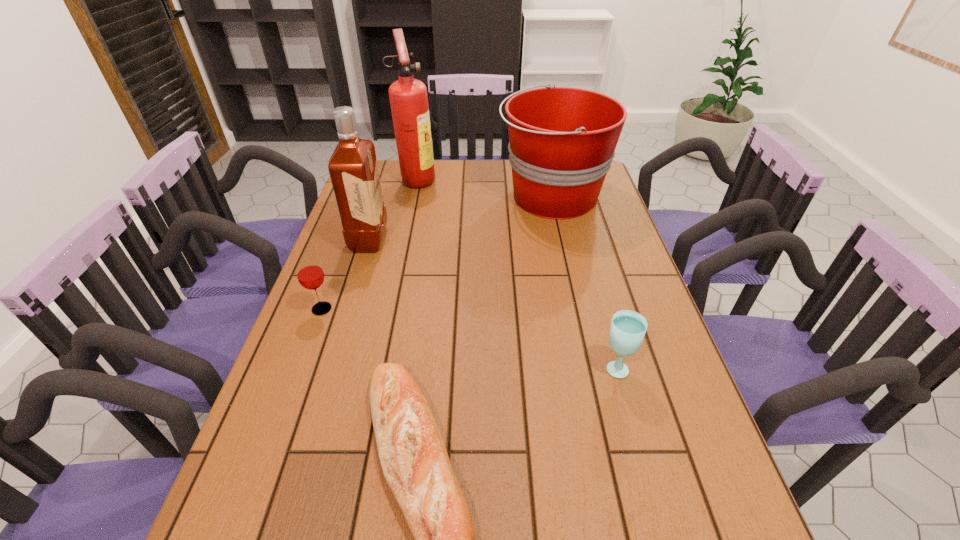
Locate an element on the screen. The height and width of the screenshot is (540, 960). free space at the far edge is located at coordinates (491, 183).

The width and height of the screenshot is (960, 540). In the image, there is a desktop. What are the coordinates of `free space at the left edge` in the screenshot? It's located at (227, 523).

The height and width of the screenshot is (540, 960). In order to click on free spot at the right edge of the desktop in this screenshot , I will do `click(642, 284)`.

The width and height of the screenshot is (960, 540). I want to click on vacant space at the far left corner, so click(396, 160).

You are a GUI agent. You are given a task and a screenshot of the screen. Output one action in this format:
    pyautogui.click(x=<x>, y=<y>)
    Task: Click on the free space between the left glass and the liquor
    The width and height of the screenshot is (960, 540).
    Given the screenshot: What is the action you would take?
    pyautogui.click(x=346, y=274)

This screenshot has width=960, height=540. Find the location of `vacant space that is in between the tallest object and the nearer glass`. vacant space that is in between the tallest object and the nearer glass is located at coordinates (516, 273).

Where is `empty space between the nearer glass and the tallest object`? This screenshot has width=960, height=540. empty space between the nearer glass and the tallest object is located at coordinates (516, 273).

Locate an element on the screen. The width and height of the screenshot is (960, 540). empty space between the left glass and the fifth shortest object is located at coordinates (346, 274).

I want to click on object identified as the fourth closest to the bucket, so click(309, 272).

Choose which object is the nearest neighbor to the fire extinguisher. Please provide its 2D coordinates. Your answer should be formatted as a tuple, i.e. [(x, y)], where the tuple contains the x and y coordinates of a point satisfying the conditions above.

[(353, 169)]